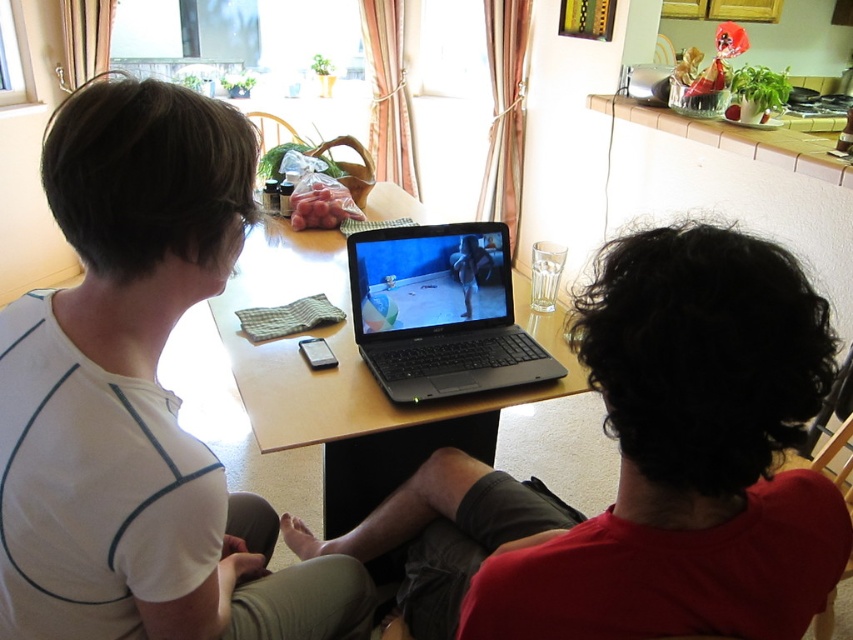
Based on the photo, you are a photographer setting up for a group photo. You notice two white matte shirts in the scene. The first is labeled as the white matte shirt at upper left, and the second is the white matte shirt at left. From your position at the camera, which shirt should you adjust to ensure both shirts are centered in the frame?

The white matte shirt at left should be moved to the right to align with the white matte shirt at upper left, as the white matte shirt at upper left is already positioned to the right of the white matte shirt at left.

In the scene shown: You are a photographer trying to capture a clear photo of the black matte laptop at center. However, the white matte shirt at left is blocking your view. Can you move the shirt to get an unobstructed shot of the laptop?

The white matte shirt at left is in front of the black matte laptop at center, so you need to move the white matte shirt at left to get an unobstructed shot of the black matte laptop at center.